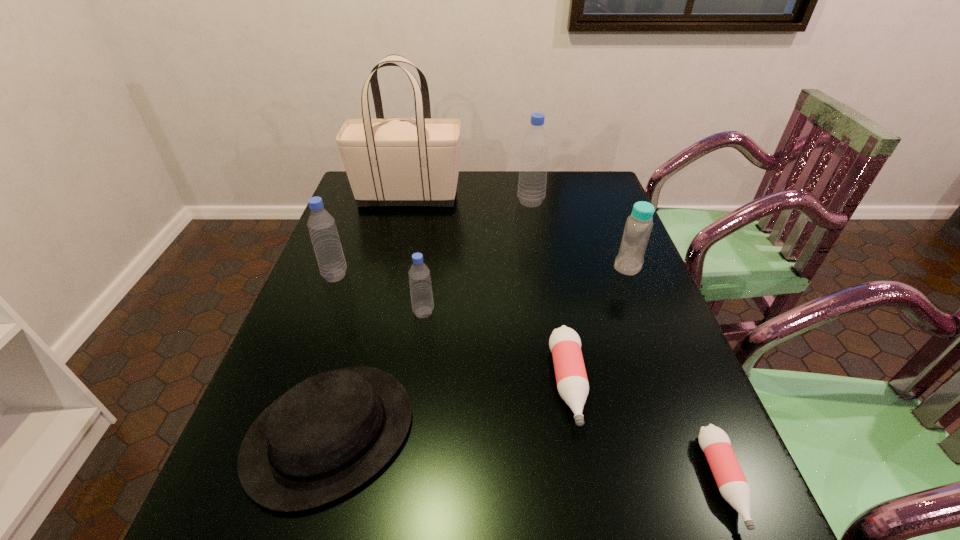
Select which blue bottle appears as the third closest to the shortest object. Please provide its 2D coordinates. Your answer should be formatted as a tuple, i.e. [(x, y)], where the tuple contains the x and y coordinates of a point satisfying the conditions above.

[(531, 192)]

Identify the location of vacant space that satisfies the following two spatial constraints: 1. on the front side of the farthest bottle; 2. on the left side of the rightmost blue bottle. (541, 266).

Find the location of a particular element. vacant point that satisfies the following two spatial constraints: 1. with handles facing forward on the shopping bag; 2. on the left side of the fourth nearest object is located at coordinates (381, 312).